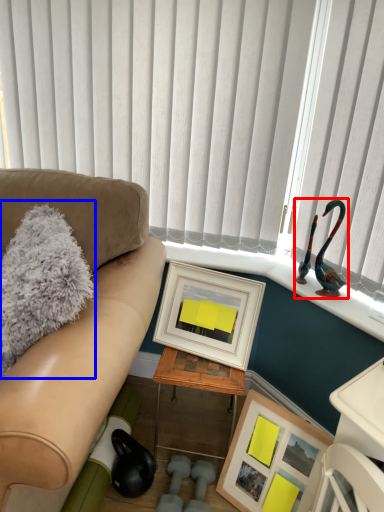
Question: Which object appears farthest to the camera in this image, toy (highlighted by a red box) or pillow (highlighted by a blue box)?

Choices:
 (A) toy
 (B) pillow

Answer: (A)